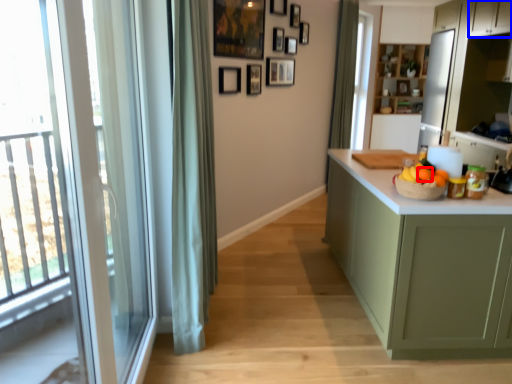
Question: Among these objects, which one is nearest to the camera, orange (highlighted by a red box) or cabinetry (highlighted by a blue box)?

Choices:
 (A) orange
 (B) cabinetry

Answer: (A)